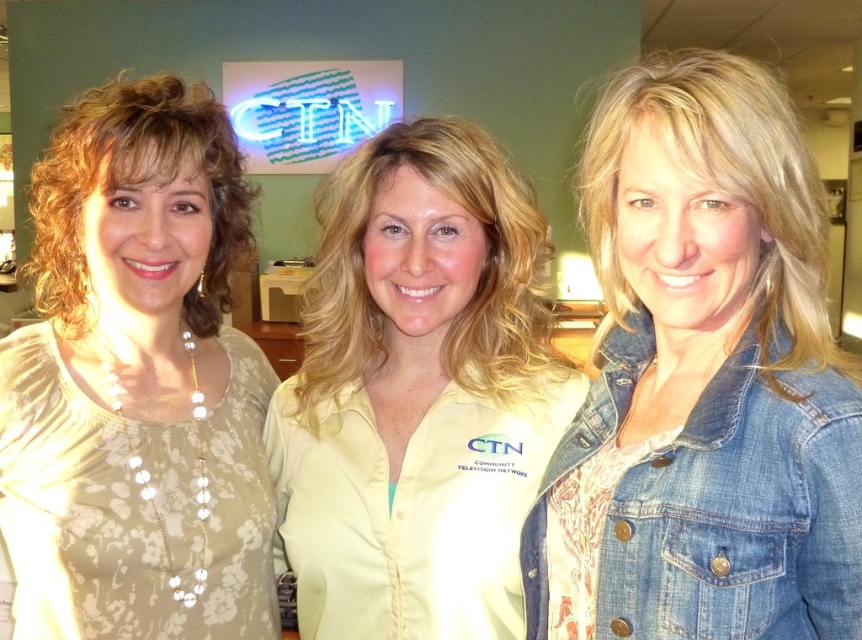
Question: Which object is positioned farthest from the yellow button-down shirt at center?

Choices:
 (A) denim jacket at lower right
 (B) matte beige blouse at left

Answer: (B)

Question: Observing the image, what is the correct spatial positioning of yellow button-down shirt at center in reference to denim jacket at lower right?

Choices:
 (A) left
 (B) right

Answer: (A)

Question: Which is farther from the yellow button-down shirt at center?

Choices:
 (A) matte beige blouse at left
 (B) denim jacket at lower right

Answer: (A)

Question: Can you confirm if matte beige blouse at left is thinner than yellow button-down shirt at center?

Choices:
 (A) yes
 (B) no

Answer: (B)

Question: Does yellow button-down shirt at center have a larger size compared to denim jacket at lower right?

Choices:
 (A) no
 (B) yes

Answer: (B)

Question: Among these objects, which one is farthest from the camera?

Choices:
 (A) yellow button-down shirt at center
 (B) matte beige blouse at left
 (C) denim jacket at lower right

Answer: (B)